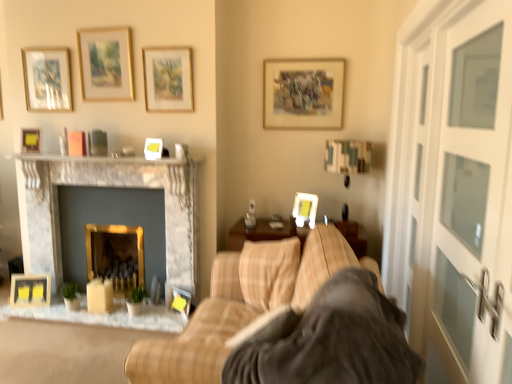
Question: From their relative heights in the image, would you say wooden picture frame at upper center, marked as the ninth picture frame in a left-to-right arrangement, is taller or shorter than matte black picture frame at lower center, which is counted as the 3th picture frame, starting from the right?

Choices:
 (A) tall
 (B) short

Answer: (A)

Question: Considering the positions of point (x=273, y=122) and point (x=187, y=296), is point (x=273, y=122) closer or farther from the camera than point (x=187, y=296)?

Choices:
 (A) closer
 (B) farther

Answer: (B)

Question: Estimate the real-world distances between objects in this image. Which object is farther from the white marble fireplace at upper center?

Choices:
 (A) matte yellow picture frame at upper left, which is counted as the second picture frame, starting from the left
 (B) matte wooden picture frame at upper left, the 4th picture frame positioned from the left
 (C) matte wooden picture frame at lower left, the 10th picture frame when ordered from right to left
 (D) beige plaid couch at center
 (E) matte gold picture frame at upper center, which is the 7th picture frame from left to right

Answer: (D)

Question: Estimate the real-world distances between objects in this image. Which object is farther from the white glass door at right?

Choices:
 (A) wooden picture frame at center, the 6th picture frame from the right
 (B) white glossy picture frame at center, which appears as the sixth picture frame when viewed from the left
 (C) matte gold picture frame at upper center, which is the 7th picture frame from left to right
 (D) matte yellow picture frame at upper left, placed as the 9th picture frame when sorted from right to left
 (E) wooden picture frame at upper center, which is the second picture frame from right to left

Answer: (D)